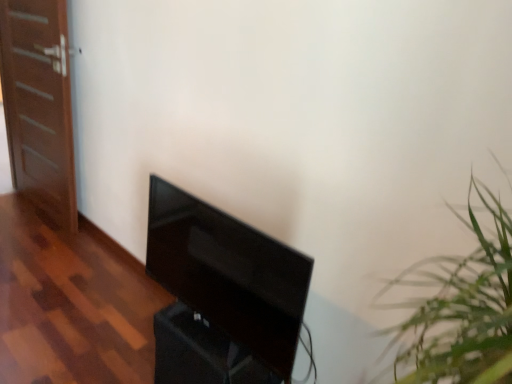
This screenshot has height=384, width=512. In order to click on free spot below brown wooden door at left (from a real-world perspective) in this screenshot , I will do `click(41, 209)`.